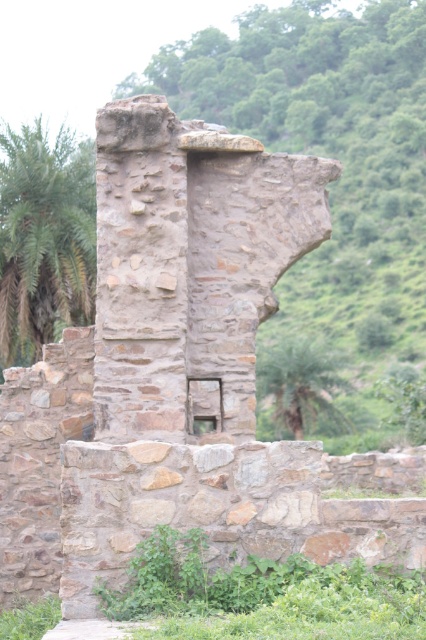
Question: Which object is farther from the camera taking this photo?

Choices:
 (A) green leafy vegetation at lower center
 (B) green leafy palm tree at center

Answer: (B)

Question: Is green leafy palm tree at left above green leafy palm tree at center?

Choices:
 (A) yes
 (B) no

Answer: (A)

Question: Estimate the real-world distances between objects in this image. Which object is closer to the green leafy vegetation at lower center?

Choices:
 (A) green leafy palm tree at left
 (B) green leafy palm tree at center

Answer: (A)

Question: Which of the following is the closest to the observer?

Choices:
 (A) (178, 532)
 (B) (29, 266)
 (C) (317, 340)

Answer: (A)

Question: Does green leafy vegetation at lower center appear under green leafy palm tree at left?

Choices:
 (A) no
 (B) yes

Answer: (B)

Question: Does green leafy vegetation at lower center have a smaller size compared to green leafy palm tree at center?

Choices:
 (A) yes
 (B) no

Answer: (A)